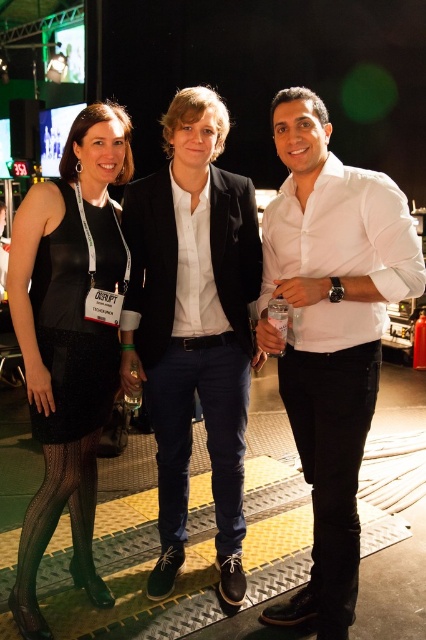
Question: Which object is the closest to the black mesh dress at left?

Choices:
 (A) dark blue denim pants at center
 (B) black leather pants at right

Answer: (A)

Question: Based on their relative distances, which object is nearer to the dark blue denim pants at center?

Choices:
 (A) white smooth shirt at center
 (B) black mesh dress at left
 (C) white cotton shirt at center

Answer: (C)

Question: Which of the following is the closest to the observer?

Choices:
 (A) (362, 372)
 (B) (235, 536)
 (C) (124, 148)

Answer: (A)

Question: Can you confirm if white smooth shirt at center is positioned to the right of black leather pants at right?

Choices:
 (A) yes
 (B) no

Answer: (A)

Question: Is white smooth shirt at center positioned in front of black mesh dress at left?

Choices:
 (A) no
 (B) yes

Answer: (B)

Question: Is white smooth shirt at center above black leather pants at right?

Choices:
 (A) no
 (B) yes

Answer: (B)